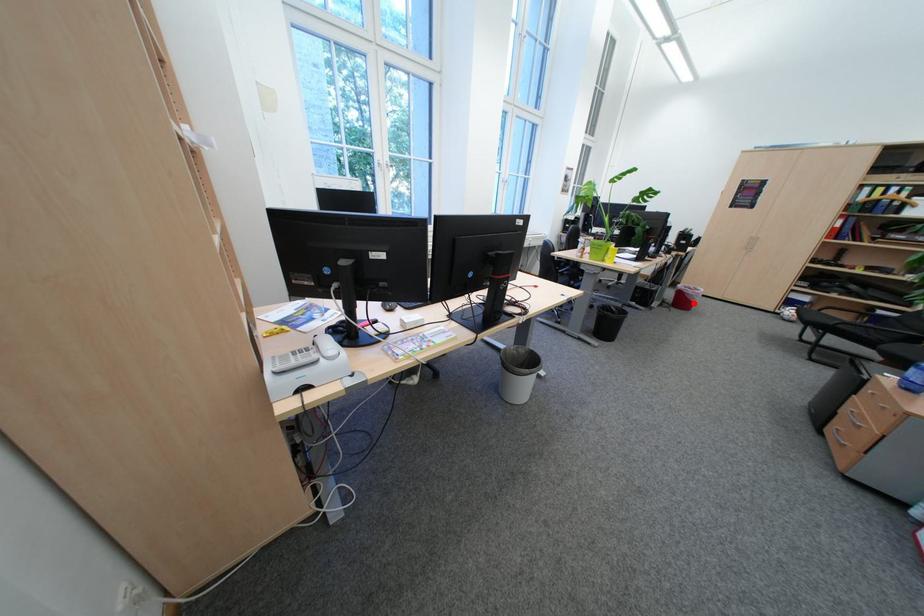
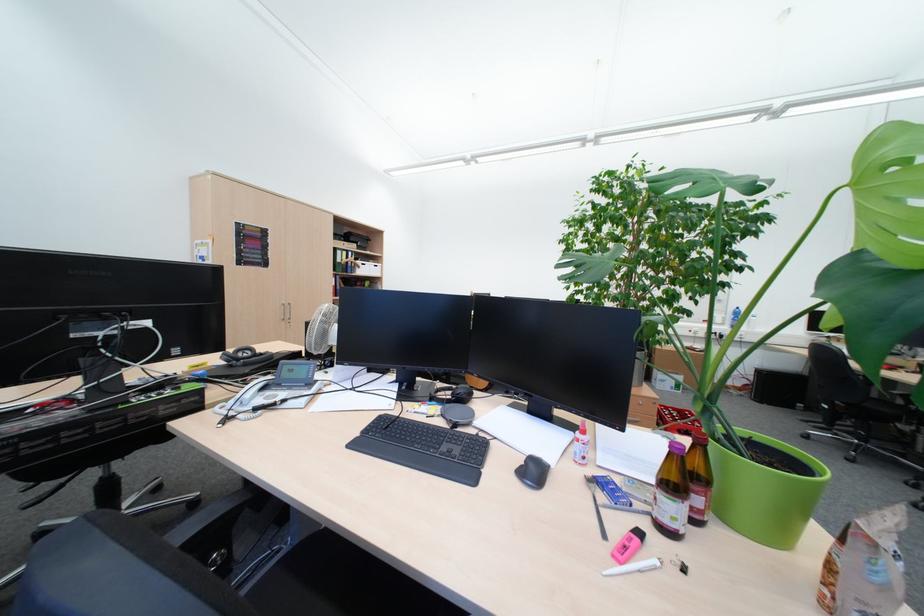
Question: I am providing you with two images of the same scene from different viewpoints. A red point is marked on the first image. Is the red point's position out of view in image 2?

Choices:
 (A) Yes
 (B) No

Answer: (A)